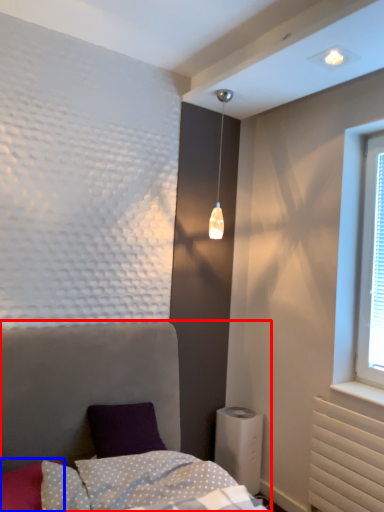
Question: Which of the following is the closest to the observer, bed (highlighted by a red box) or pillow (highlighted by a blue box)?

Choices:
 (A) bed
 (B) pillow

Answer: (A)